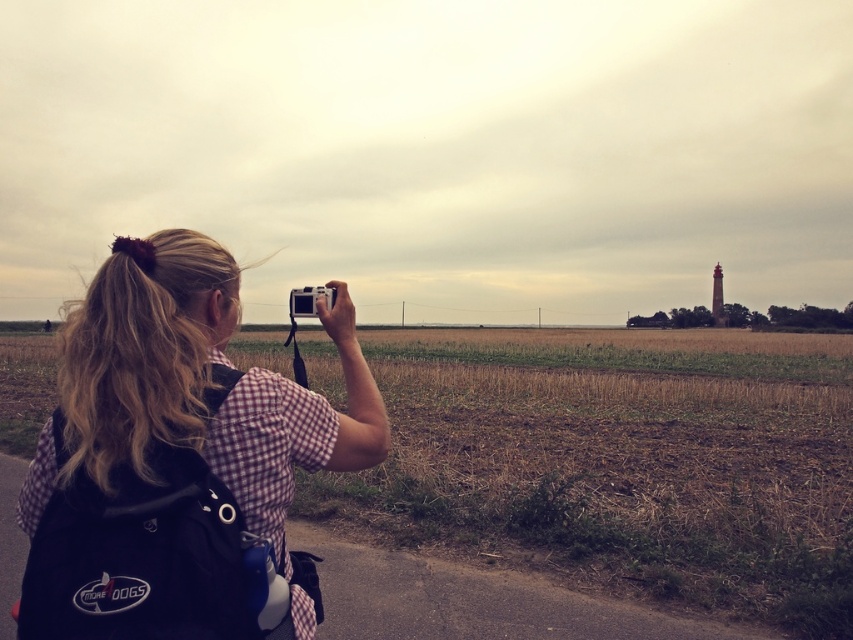
Question: Among these objects, which one is farthest from the camera?

Choices:
 (A) checkered fabric shirt at center
 (B) brown grass at center
 (C) silver metallic camera at upper center

Answer: (B)

Question: Is brown grass at center below checkered fabric shirt at center?

Choices:
 (A) yes
 (B) no

Answer: (A)

Question: Which point is farther to the camera?

Choices:
 (A) checkered fabric shirt at center
 (B) silver metallic camera at upper center
 (C) brown grass at center

Answer: (C)

Question: Is checkered fabric shirt at center bigger than silver metallic camera at upper center?

Choices:
 (A) yes
 (B) no

Answer: (A)

Question: Among these points, which one is farthest from the camera?

Choices:
 (A) (289, 492)
 (B) (289, 307)

Answer: (B)

Question: Does brown grass at center have a larger size compared to checkered fabric shirt at center?

Choices:
 (A) no
 (B) yes

Answer: (B)